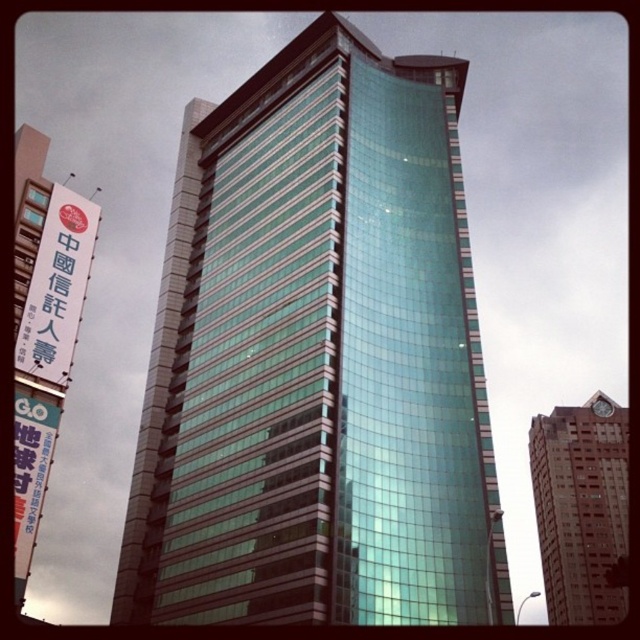
You are standing at the camera position looking at the green glass building at center. If you walk straight towards it for 100 feet, will you reach the building?

The green glass building at center is 143.58 feet away from the camera. After walking 100 feet towards it, you would still be 43.58 feet away, so you have not reached the building yet.

You are a city planner reviewing the urban skyline and notice the brick textured building at upper right and the white paper sign at left. Which object appears taller in the scene?

The brick textured building at upper right has a greater height compared to the white paper sign at left, so the brick textured building at upper right appears taller.

You are a city planner evaluating the new green glass building at center and the white paper sign at left. Which object occupies more horizontal space in the image?

The green glass building at center has a greater width than the white paper sign at left, so it occupies more horizontal space in the image.